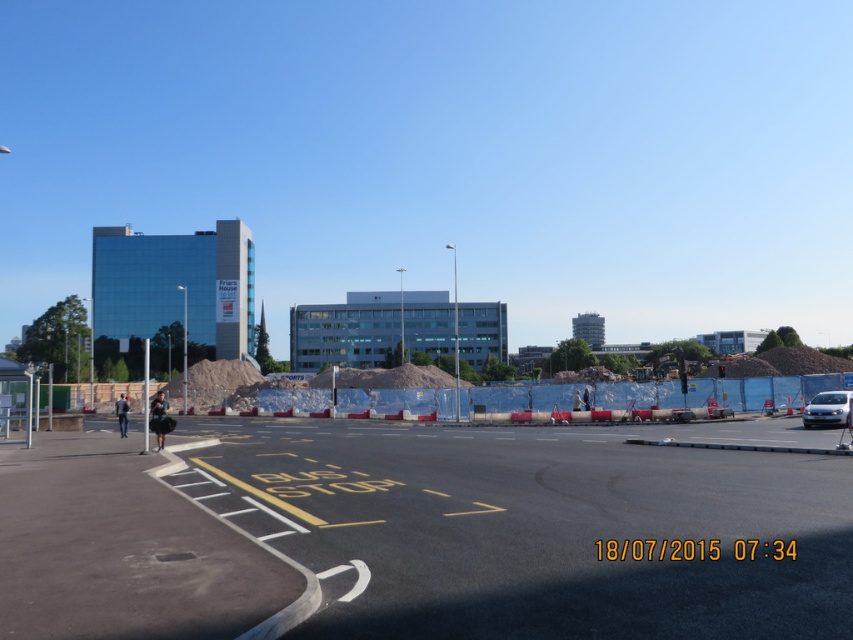
You are a delivery driver who needs to park your satin silver car at right in the bus stop zone marked with yellow lines. Can you park your car there without overlapping the black asphalt at center?

The black asphalt at center is positioned on the left side of satin silver car at right, so parking the satin silver car at right in the bus stop zone marked with yellow lines would place it to the right of the black asphalt at center. However, parking in the bus stop zone is typically prohibited, so you should avoid parking there to comply with traffic regulations.